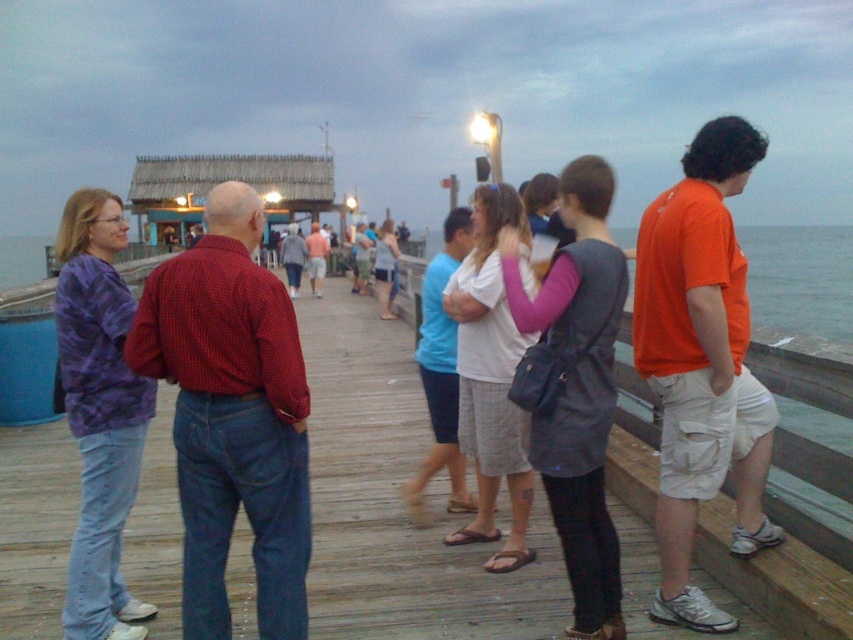
Looking at this image, you are standing at the edge of the wooden pier in the image. There is a dark gray fabric vest at center located at point (578,388). Can you see the dark gray fabric vest at center from your current position?

Yes, the dark gray fabric vest at center is located at point (578,388), so it is visible from the edge of the wooden pier.